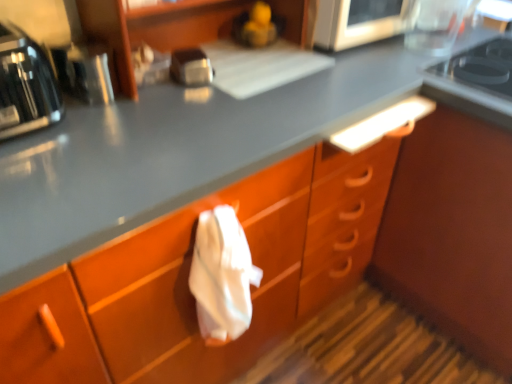
Question: Is satin silver toaster at upper center outside of black glass gas stove at upper right?

Choices:
 (A) no
 (B) yes

Answer: (B)

Question: Considering the relative sizes of satin silver toaster at upper center and black glass gas stove at upper right in the image provided, is satin silver toaster at upper center shorter than black glass gas stove at upper right?

Choices:
 (A) no
 (B) yes

Answer: (A)

Question: Is satin silver toaster at upper center oriented away from black glass gas stove at upper right?

Choices:
 (A) yes
 (B) no

Answer: (B)

Question: From a real-world perspective, is satin silver toaster at upper center physically below black glass gas stove at upper right?

Choices:
 (A) yes
 (B) no

Answer: (B)

Question: Would you say black glass gas stove at upper right is part of satin silver toaster at upper center's contents?

Choices:
 (A) no
 (B) yes

Answer: (A)

Question: In terms of size, does metallic silver toaster at left, the 2th appliance from the top, appear bigger or smaller than black glass gas stove at upper right?

Choices:
 (A) small
 (B) big

Answer: (A)

Question: From a real-world perspective, is metallic silver toaster at left, which is counted as the second appliance, starting from the back, above or below black glass gas stove at upper right?

Choices:
 (A) above
 (B) below

Answer: (A)

Question: Considering their positions, is metallic silver toaster at left, which is the first appliance from left to right, located in front of or behind black glass gas stove at upper right?

Choices:
 (A) behind
 (B) front

Answer: (B)

Question: From the image's perspective, is metallic silver toaster at left, the 2th appliance from the top, above or below black glass gas stove at upper right?

Choices:
 (A) below
 (B) above

Answer: (A)

Question: Considering the positions of point (394, 31) and point (176, 56), is point (394, 31) closer or farther from the camera than point (176, 56)?

Choices:
 (A) farther
 (B) closer

Answer: (A)

Question: Considering the positions of metallic silver microwave at upper center, acting as the first appliance starting from the right, and satin silver toaster at upper center in the image, is metallic silver microwave at upper center, acting as the first appliance starting from the right, wider or thinner than satin silver toaster at upper center?

Choices:
 (A) wide
 (B) thin

Answer: (A)

Question: In the image, is metallic silver microwave at upper center, the second appliance positioned from the front, positioned in front of or behind satin silver toaster at upper center?

Choices:
 (A) behind
 (B) front

Answer: (A)

Question: From a real-world perspective, is metallic silver microwave at upper center, the second appliance positioned from the front, positioned above or below satin silver toaster at upper center?

Choices:
 (A) above
 (B) below

Answer: (A)

Question: Is point (431, 79) closer or farther from the camera than point (118, 3)?

Choices:
 (A) closer
 (B) farther

Answer: (B)

Question: From their relative heights in the image, would you say black glass gas stove at upper right is taller or shorter than wooden shelf at upper center?

Choices:
 (A) tall
 (B) short

Answer: (B)